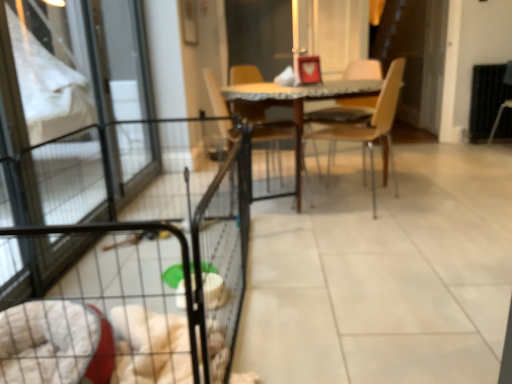
Question: Can you confirm if dark brown leather armchair at right is shorter than wooden table at center?

Choices:
 (A) yes
 (B) no

Answer: (B)

Question: Considering the relative sizes of dark brown leather armchair at right and wooden table at center in the image provided, is dark brown leather armchair at right wider than wooden table at center?

Choices:
 (A) yes
 (B) no

Answer: (B)

Question: From the image's perspective, is dark brown leather armchair at right located beneath wooden table at center?

Choices:
 (A) yes
 (B) no

Answer: (B)

Question: Can you confirm if dark brown leather armchair at right is smaller than wooden table at center?

Choices:
 (A) no
 (B) yes

Answer: (B)

Question: Would you say dark brown leather armchair at right is outside wooden table at center?

Choices:
 (A) no
 (B) yes

Answer: (B)

Question: Does dark brown leather armchair at right have a larger size compared to wooden table at center?

Choices:
 (A) yes
 (B) no

Answer: (B)

Question: Is wooden table at center at the right side of wooden chair at center, which is counted as the 1th chair, starting from the left?

Choices:
 (A) no
 (B) yes

Answer: (B)

Question: Is wooden table at center taller than wooden chair at center, the 2th chair in the right-to-left sequence?

Choices:
 (A) no
 (B) yes

Answer: (A)

Question: Is wooden table at center next to wooden chair at center, the 2th chair in the right-to-left sequence?

Choices:
 (A) yes
 (B) no

Answer: (B)

Question: Considering the relative sizes of wooden table at center and wooden chair at center, the 2th chair in the right-to-left sequence, in the image provided, is wooden table at center bigger than wooden chair at center, the 2th chair in the right-to-left sequence,?

Choices:
 (A) yes
 (B) no

Answer: (A)

Question: Can you confirm if wooden table at center is thinner than wooden chair at center, the 2th chair in the right-to-left sequence?

Choices:
 (A) yes
 (B) no

Answer: (B)

Question: From a real-world perspective, is wooden table at center over wooden chair at center, which is counted as the 1th chair, starting from the left?

Choices:
 (A) yes
 (B) no

Answer: (B)

Question: Does black wire cage at lower left have a smaller size compared to wooden table at center?

Choices:
 (A) yes
 (B) no

Answer: (B)